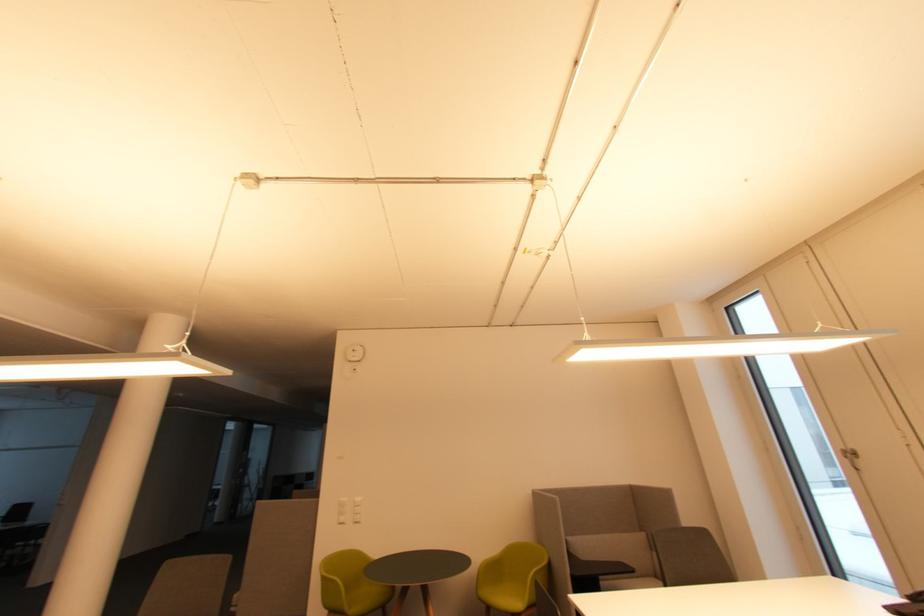
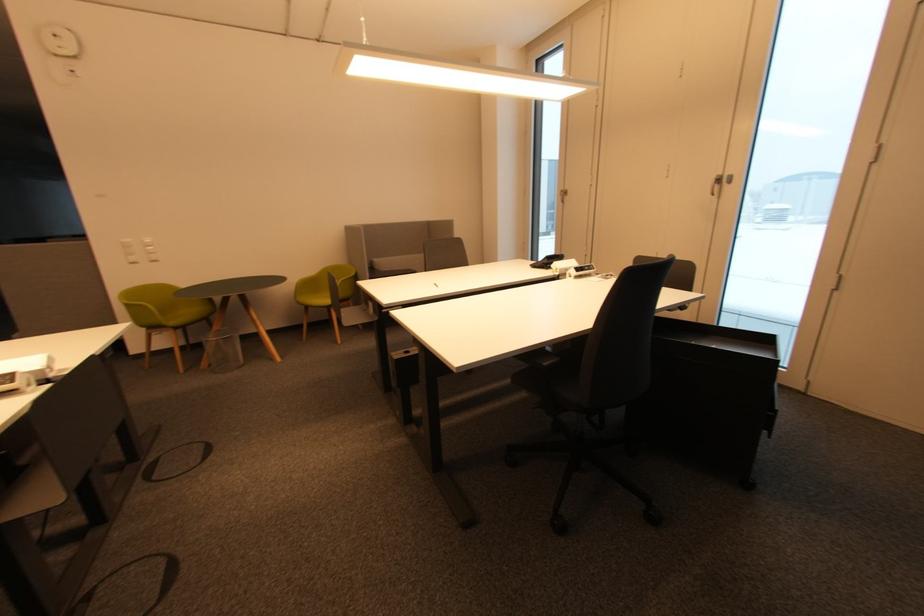
The images are taken continuously from a first-person perspective. In which direction is your viewpoint rotating?

The camera's rotation is toward right-down.